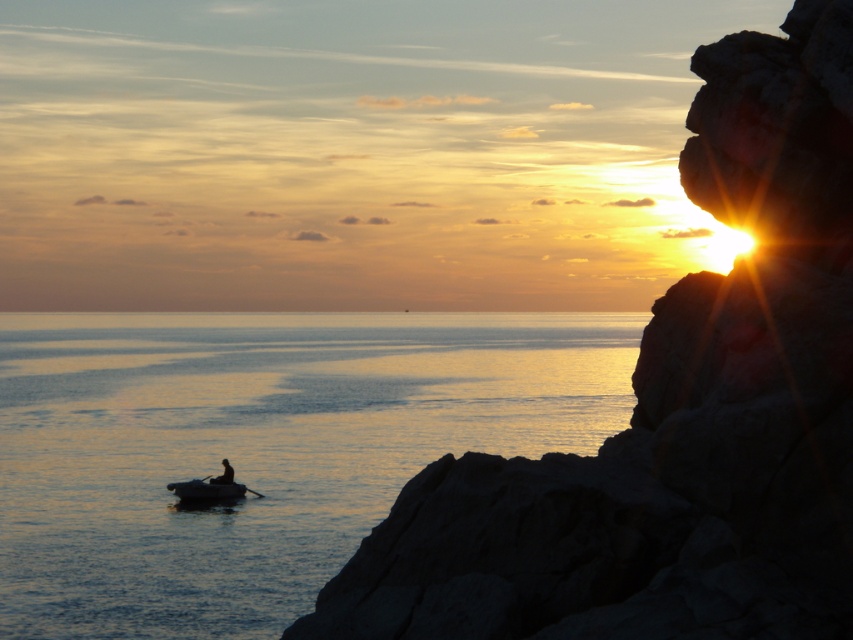
Question: Considering the relative positions of dark gray rubber boat at center-left and silhouette wooden boat at lower left in the image provided, where is dark gray rubber boat at center-left located with respect to silhouette wooden boat at lower left?

Choices:
 (A) above
 (B) below

Answer: (B)

Question: Which point is farther to the camera?

Choices:
 (A) dark gray rubber boat at center-left
 (B) rugged stone cliff at right
 (C) silvery reflective water at center
 (D) silhouette wooden boat at lower left

Answer: (D)

Question: Is rugged stone cliff at right to the left of dark gray rubber boat at center-left from the viewer's perspective?

Choices:
 (A) yes
 (B) no

Answer: (B)

Question: Considering the real-world distances, which object is closest to the silvery reflective water at center?

Choices:
 (A) rugged stone cliff at right
 (B) dark gray rubber boat at center-left
 (C) silhouette wooden boat at lower left

Answer: (A)

Question: Based on their relative distances, which object is nearer to the silvery reflective water at center?

Choices:
 (A) dark gray rubber boat at center-left
 (B) rugged stone cliff at right

Answer: (B)

Question: Can you confirm if silvery reflective water at center is positioned below silhouette wooden boat at lower left?

Choices:
 (A) no
 (B) yes

Answer: (A)